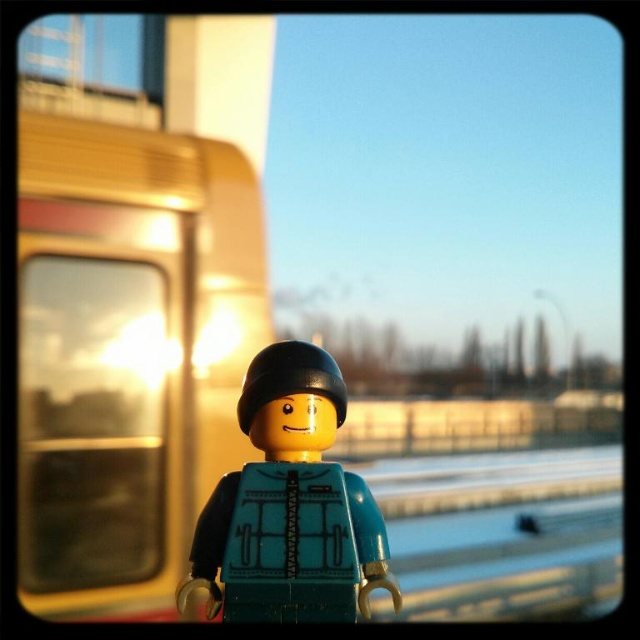
Is transparent glass train window at left taller than matte teal plastic minifigure at center?

Yes.

Image resolution: width=640 pixels, height=640 pixels. What do you see at coordinates (92, 422) in the screenshot?
I see `transparent glass train window at left` at bounding box center [92, 422].

Who is more forward, (x=88, y=436) or (x=380, y=548)?

Point (x=380, y=548) is more forward.

At what (x,y) coordinates should I click in order to perform the action: click on transparent glass train window at left. Please return your answer as a coordinate pair (x, y). Looking at the image, I should click on (92, 422).

Can you confirm if metallic gold train at left is taller than matte teal plastic minifigure at center?

Indeed, metallic gold train at left has a greater height compared to matte teal plastic minifigure at center.

Is point (106, 486) closer to viewer compared to point (244, 394)?

No, (106, 486) is behind (244, 394).

Where is `metallic gold train at left`? metallic gold train at left is located at coordinates (129, 348).

Consider the image. Does metallic gold train at left appear under transparent glass train window at left?

No, metallic gold train at left is not below transparent glass train window at left.

Who is more distant from viewer, [246,230] or [138,445]?

The point [246,230] is more distant.

Locate an element on the screen. metallic gold train at left is located at coordinates (129, 348).